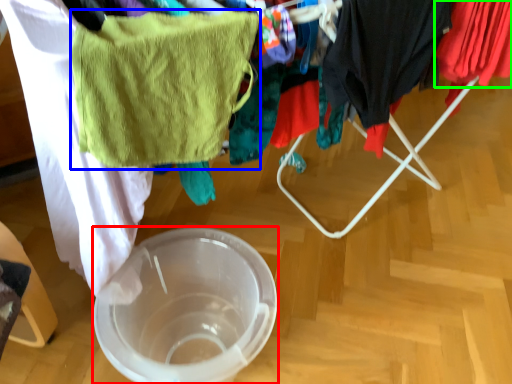
Question: Estimate the real-world distances between objects in this image. Which object is farther from glass bowl (highlighted by a red box), towel/napkin (highlighted by a blue box) or clothing (highlighted by a green box)?

Choices:
 (A) towel/napkin
 (B) clothing

Answer: (B)